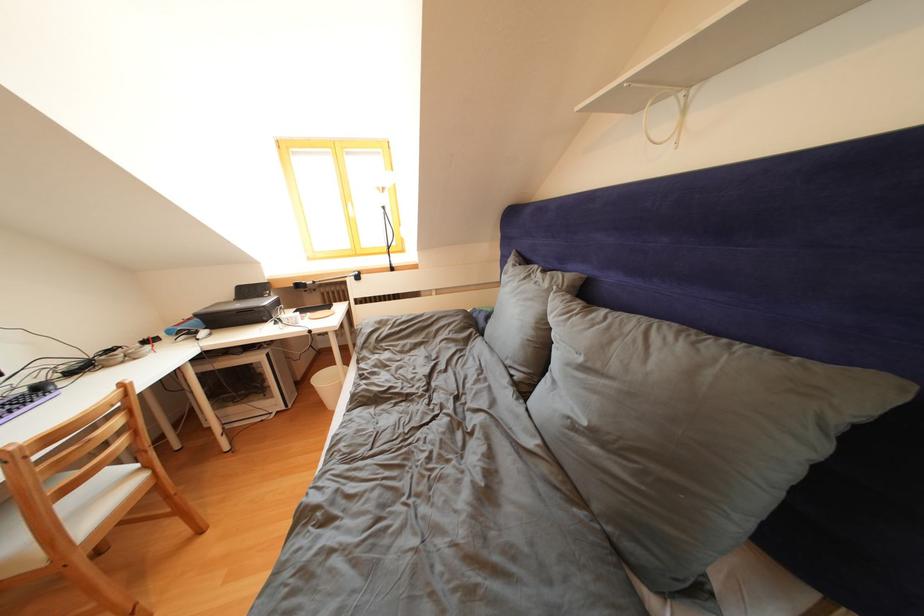
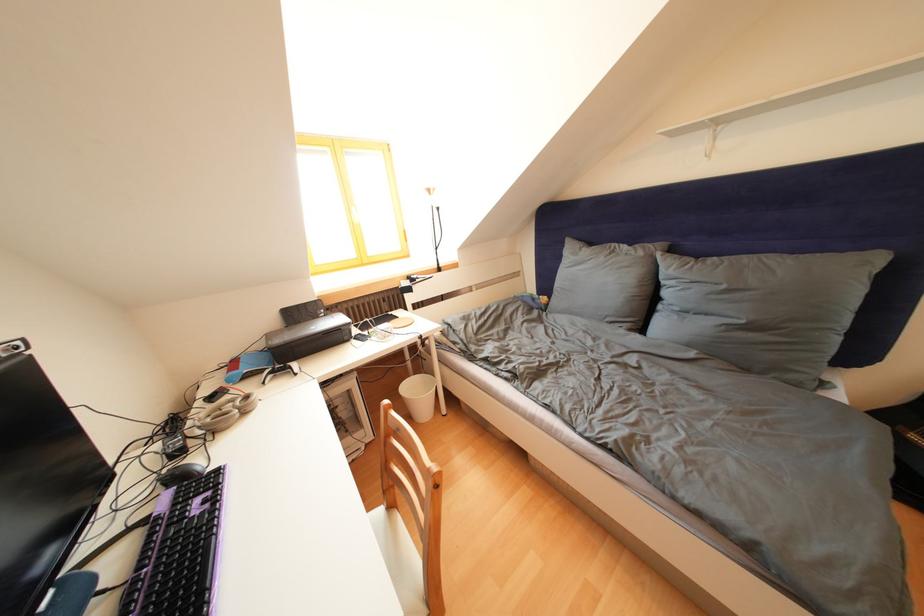
Locate, in the second image, the point that corresponds to point (590, 363) in the first image.

(733, 292)